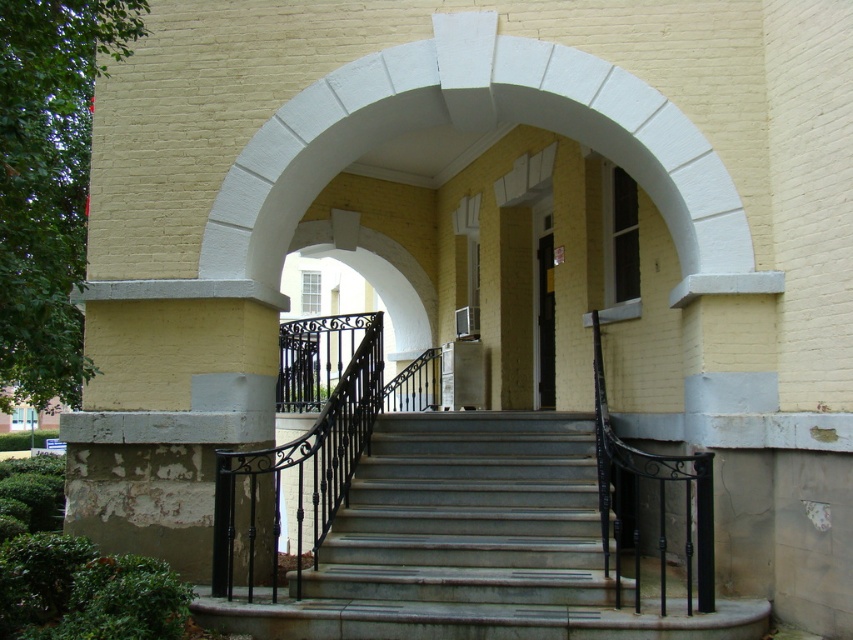
Is point (543, 512) farther from camera compared to point (549, 401)?

No, it is in front of (549, 401).

Is gray concrete stairs at center behind black glass door at center?

No.

What do you see at coordinates (469, 513) in the screenshot?
I see `gray concrete stairs at center` at bounding box center [469, 513].

Where is `gray concrete stairs at center`? Image resolution: width=853 pixels, height=640 pixels. gray concrete stairs at center is located at coordinates (469, 513).